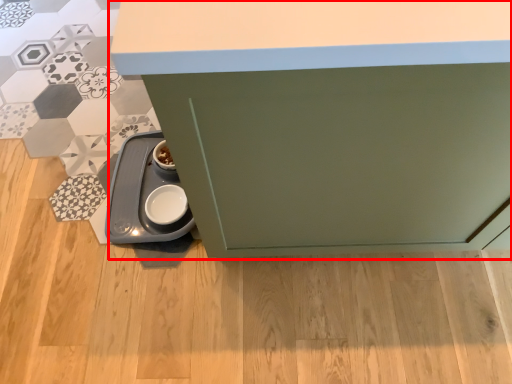
Question: From the image's perspective, where is cabinetry (annotated by the red box) located in relation to appliance in the image?

Choices:
 (A) above
 (B) below

Answer: (A)